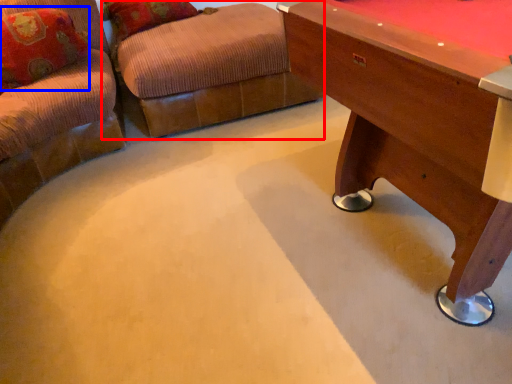
Question: Which object is further to the camera taking this photo, swivel chair (highlighted by a red box) or pillow (highlighted by a blue box)?

Choices:
 (A) swivel chair
 (B) pillow

Answer: (A)